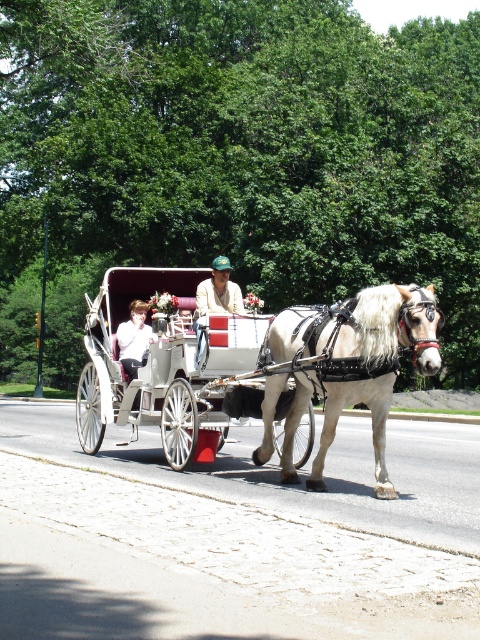
Question: Is white leather wagon at center bigger than white cotton shirt at center?

Choices:
 (A) yes
 (B) no

Answer: (A)

Question: Among these objects, which one is farthest from the camera?

Choices:
 (A) white cotton shirt at center
 (B) white glossy horse at center
 (C) white leather wagon at center
 (D) light brown leather jacket at center

Answer: (A)

Question: Among these points, which one is farthest from the camera?

Choices:
 (A) (184, 275)
 (B) (415, 291)

Answer: (A)

Question: Which point is closer to the camera taking this photo?

Choices:
 (A) (237, 294)
 (B) (302, 408)
 (C) (132, 346)

Answer: (B)

Question: Where is light brown leather jacket at center located in relation to white cotton shirt at center in the image?

Choices:
 (A) above
 (B) below

Answer: (A)

Question: Where is white glossy horse at center located in relation to white cotton shirt at center in the image?

Choices:
 (A) left
 (B) right

Answer: (B)